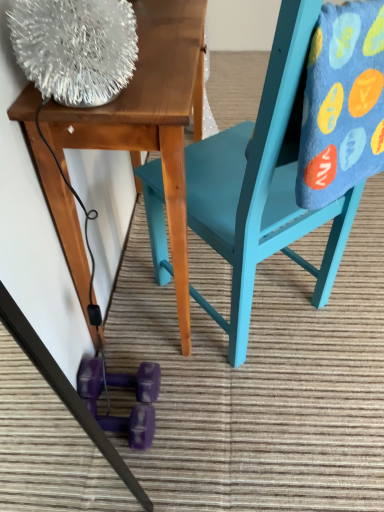
Question: Would you say wooden table at upper left is a long distance from teal painted wood chair at center?

Choices:
 (A) yes
 (B) no

Answer: (B)

Question: From a real-world perspective, is wooden table at upper left over teal painted wood chair at center?

Choices:
 (A) no
 (B) yes

Answer: (A)

Question: Does wooden table at upper left contain teal painted wood chair at center?

Choices:
 (A) yes
 (B) no

Answer: (B)

Question: From the image's perspective, does wooden table at upper left appear lower than teal painted wood chair at center?

Choices:
 (A) no
 (B) yes

Answer: (A)

Question: Is wooden table at upper left positioned with its back to teal painted wood chair at center?

Choices:
 (A) no
 (B) yes

Answer: (B)

Question: From the image's perspective, is wooden table at upper left on top of teal painted wood chair at center?

Choices:
 (A) no
 (B) yes

Answer: (B)

Question: Is wooden table at upper left further to camera compared to purple rubber dumbbell at lower center?

Choices:
 (A) yes
 (B) no

Answer: (B)

Question: From the image's perspective, is wooden table at upper left over purple rubber dumbbell at lower center?

Choices:
 (A) yes
 (B) no

Answer: (A)

Question: From a real-world perspective, is wooden table at upper left positioned under purple rubber dumbbell at lower center based on gravity?

Choices:
 (A) yes
 (B) no

Answer: (B)

Question: Is wooden table at upper left positioned with its back to purple rubber dumbbell at lower center?

Choices:
 (A) yes
 (B) no

Answer: (B)

Question: Considering the relative sizes of wooden table at upper left and purple rubber dumbbell at lower center in the image provided, is wooden table at upper left bigger than purple rubber dumbbell at lower center?

Choices:
 (A) no
 (B) yes

Answer: (B)

Question: Is there a large distance between wooden table at upper left and purple rubber dumbbell at lower center?

Choices:
 (A) yes
 (B) no

Answer: (B)

Question: From a real-world perspective, is purple rubber dumbbell at lower center positioned under wooden table at upper left based on gravity?

Choices:
 (A) yes
 (B) no

Answer: (A)